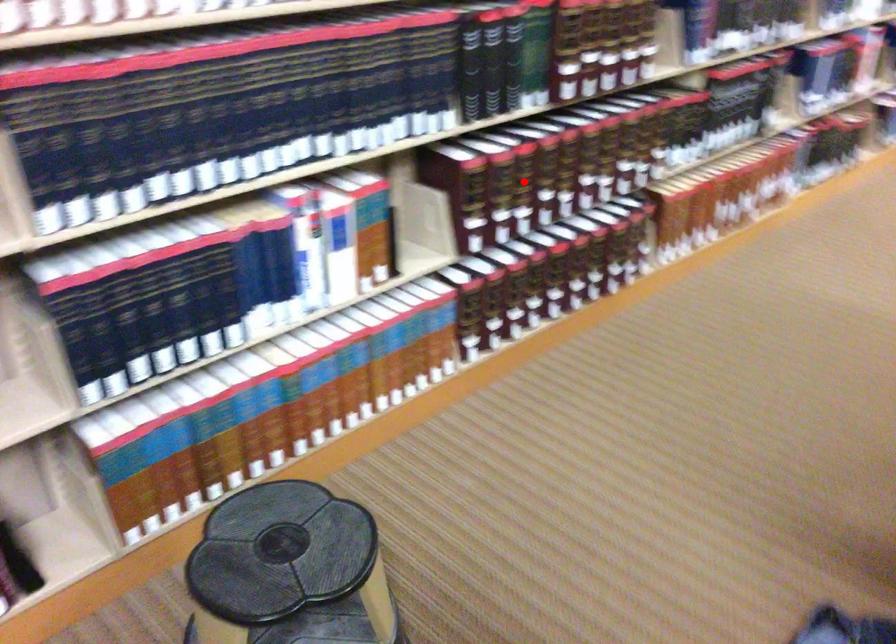
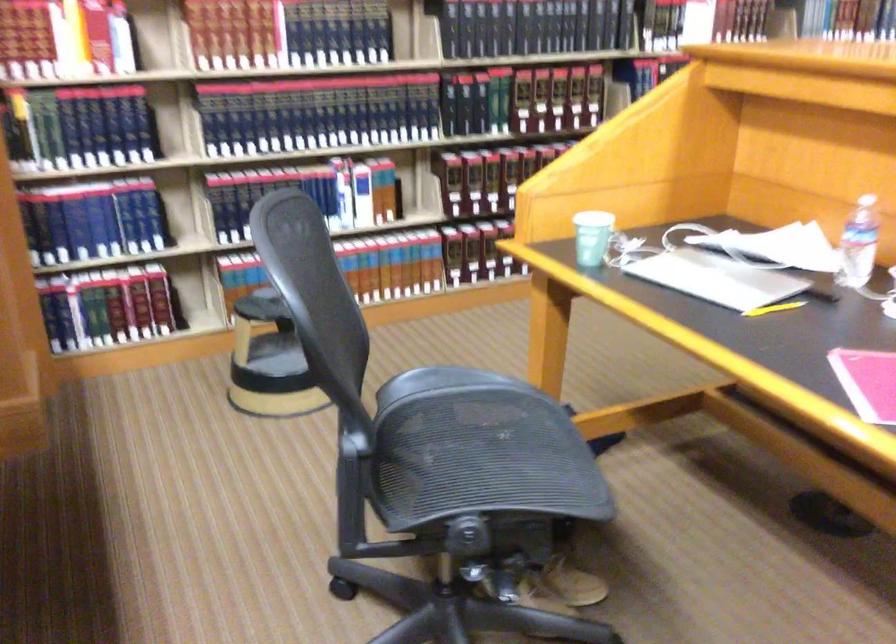
Find the pixel in the second image that matches the highlighted location in the first image.

(488, 176)